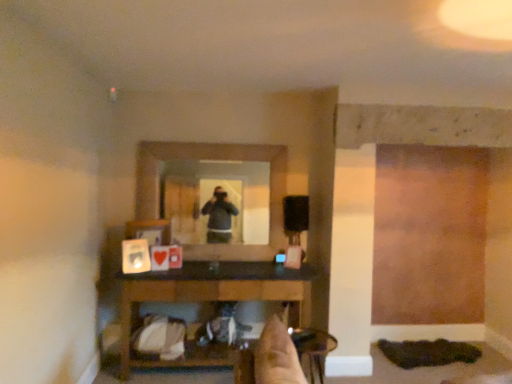
Question: Is metallic silver chair at lower center thinner than clear glass mirror at center?

Choices:
 (A) no
 (B) yes

Answer: (A)

Question: Are metallic silver chair at lower center and clear glass mirror at center making contact?

Choices:
 (A) yes
 (B) no

Answer: (B)

Question: Does metallic silver chair at lower center contain clear glass mirror at center?

Choices:
 (A) yes
 (B) no

Answer: (B)

Question: Is metallic silver chair at lower center to the left of clear glass mirror at center from the viewer's perspective?

Choices:
 (A) no
 (B) yes

Answer: (A)

Question: Is metallic silver chair at lower center not within clear glass mirror at center?

Choices:
 (A) no
 (B) yes

Answer: (B)

Question: From a real-world perspective, relative to wooden table at lower center, is metallic silver chair at lower center vertically above or below?

Choices:
 (A) below
 (B) above

Answer: (A)

Question: Is metallic silver chair at lower center inside or outside of wooden table at lower center?

Choices:
 (A) outside
 (B) inside

Answer: (A)

Question: In the image, is metallic silver chair at lower center on the left side or the right side of wooden table at lower center?

Choices:
 (A) right
 (B) left

Answer: (A)

Question: Is metallic silver chair at lower center taller or shorter than wooden table at lower center?

Choices:
 (A) short
 (B) tall

Answer: (A)

Question: Considering the positions of clear glass mirror at center and metallic silver chair at lower center in the image, is clear glass mirror at center wider or thinner than metallic silver chair at lower center?

Choices:
 (A) wide
 (B) thin

Answer: (B)

Question: In terms of height, does clear glass mirror at center look taller or shorter compared to metallic silver chair at lower center?

Choices:
 (A) tall
 (B) short

Answer: (A)

Question: From a real-world perspective, is clear glass mirror at center above or below metallic silver chair at lower center?

Choices:
 (A) above
 (B) below

Answer: (A)

Question: In the image, is clear glass mirror at center on the left side or the right side of metallic silver chair at lower center?

Choices:
 (A) right
 (B) left

Answer: (B)

Question: Considering the positions of clear glass mirror at center and wooden table at lower center in the image, is clear glass mirror at center bigger or smaller than wooden table at lower center?

Choices:
 (A) small
 (B) big

Answer: (A)

Question: Considering the positions of clear glass mirror at center and wooden table at lower center in the image, is clear glass mirror at center taller or shorter than wooden table at lower center?

Choices:
 (A) short
 (B) tall

Answer: (B)